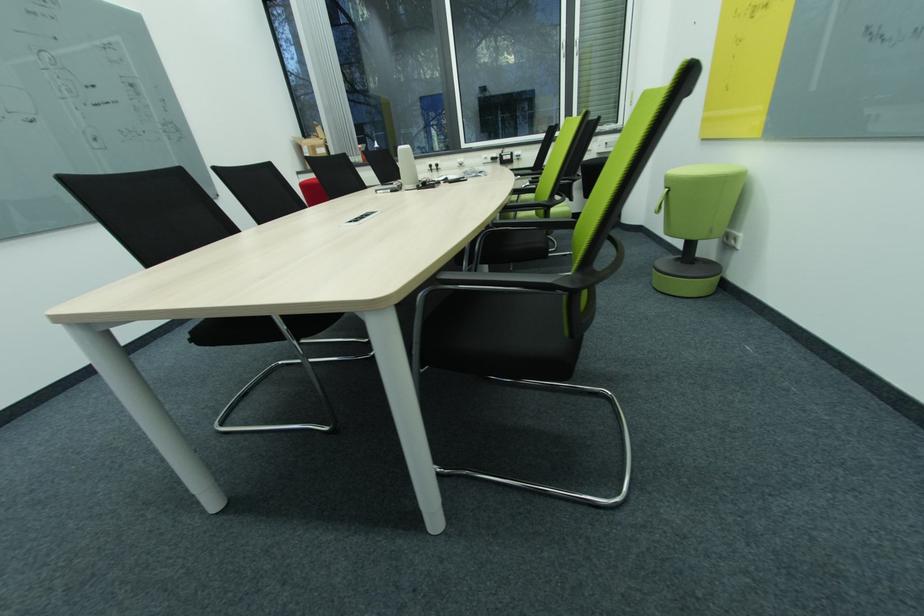
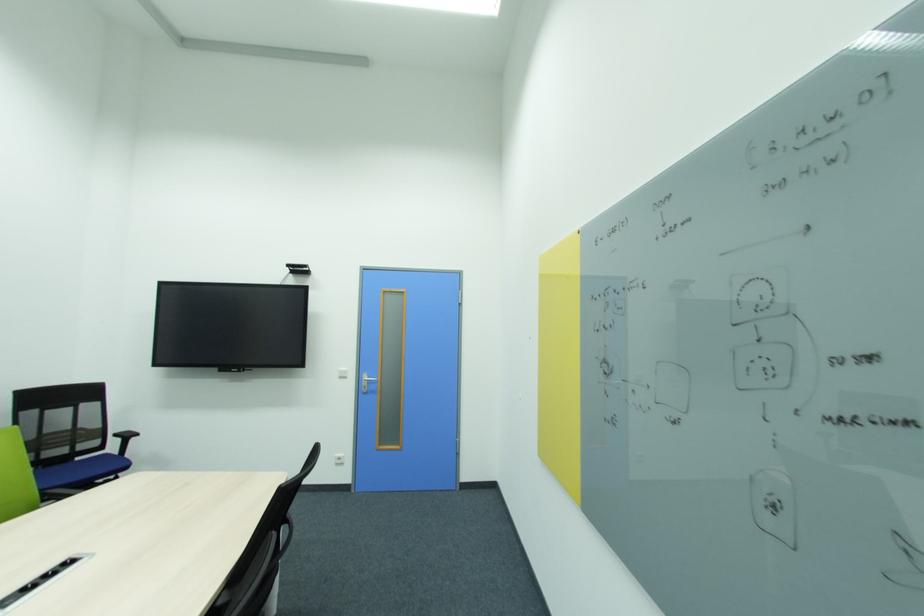
Question: I am providing you with two images of the same scene from different viewpoints. After the viewpoint changes to image2, which objects are now occluded?

Choices:
 (A) black chair sitting surface
 (B) pink pillow
 (C) blue chair sitting surface
 (D) white light switch

Answer: (A)